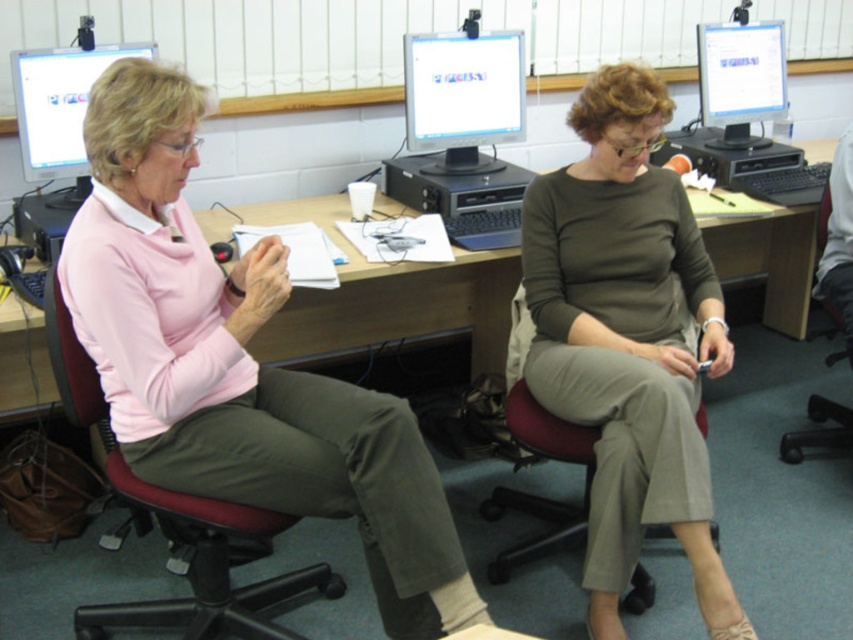
Does matte olive-green blouse at center appear under wooden desk at center?

Correct, matte olive-green blouse at center is located below wooden desk at center.

The width and height of the screenshot is (853, 640). What do you see at coordinates (628, 339) in the screenshot? I see `matte olive-green blouse at center` at bounding box center [628, 339].

In order to click on matte olive-green blouse at center in this screenshot , I will do `click(628, 339)`.

Identify the location of matte olive-green blouse at center. Image resolution: width=853 pixels, height=640 pixels. (628, 339).

Between point (577, 182) and point (50, 68), which one is positioned behind?

The point (50, 68) is more distant.

Who is positioned more to the right, matte olive-green blouse at center or matte black monitor at upper left?

matte olive-green blouse at center is more to the right.

Image resolution: width=853 pixels, height=640 pixels. What are the coordinates of `matte olive-green blouse at center` in the screenshot? It's located at (628, 339).

The image size is (853, 640). I want to click on matte olive-green blouse at center, so click(628, 339).

Does pink matte sweater at left have a smaller size compared to wooden desk at center?

Actually, pink matte sweater at left might be larger than wooden desk at center.

Is pink matte sweater at left above wooden desk at center?

Actually, pink matte sweater at left is below wooden desk at center.

The image size is (853, 640). I want to click on pink matte sweater at left, so click(x=238, y=364).

Image resolution: width=853 pixels, height=640 pixels. In order to click on pink matte sweater at left in this screenshot , I will do `click(238, 364)`.